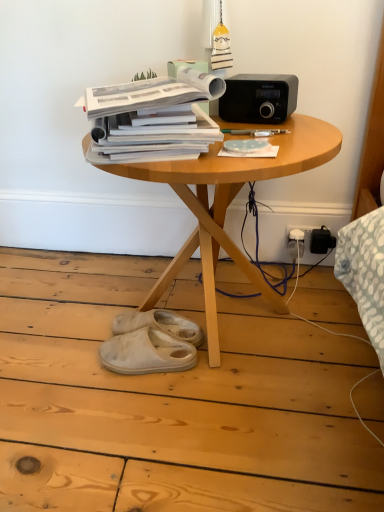
Question: Is black matte stereo at upper right inside the boundaries of white suede slippers at lower center, positioned as the first footwear in back-to-front order, or outside?

Choices:
 (A) inside
 (B) outside

Answer: (B)

Question: From a real-world perspective, is black matte stereo at upper right positioned above or below white suede slippers at lower center, marked as the second footwear in a front-to-back arrangement?

Choices:
 (A) below
 (B) above

Answer: (B)

Question: Estimate the real-world distances between objects in this image. Which object is farther from the wooden table at center?

Choices:
 (A) blue dotted paper at center, positioned as the first paperback book in right-to-left order
 (B) black matte stereo at upper right
 (C) white paper at center, placed as the second paperback book when sorted from right to left
 (D) white suede slippers at lower center, marked as the second footwear in a front-to-back arrangement
 (E) white suede slippers at lower center, which is the second footwear in back-to-front order

Answer: (E)

Question: Which of these objects is positioned farthest from the wooden table at center?

Choices:
 (A) white suede slippers at lower center, which is the second footwear in back-to-front order
 (B) blue dotted paper at center, positioned as the first paperback book in right-to-left order
 (C) white suede slippers at lower center, marked as the second footwear in a front-to-back arrangement
 (D) white paper at center, arranged as the first paperback book when viewed from the left
 (E) black matte stereo at upper right

Answer: (A)